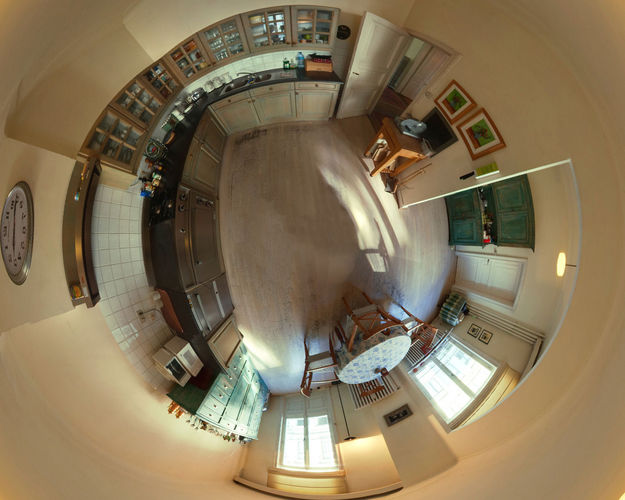
Where is `door`? This screenshot has width=625, height=500. door is located at coordinates (495, 270).